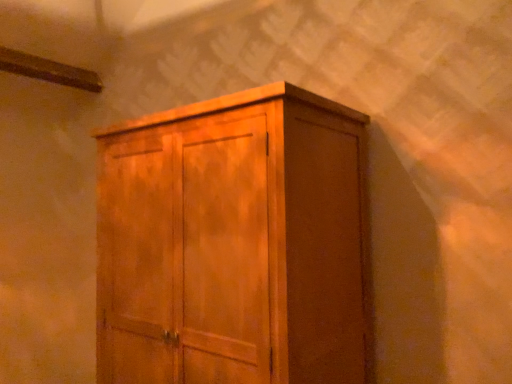
What do you see at coordinates (234, 243) in the screenshot? I see `matte wood cupboard at center` at bounding box center [234, 243].

This screenshot has width=512, height=384. Find the location of `matte wood cupboard at center`. matte wood cupboard at center is located at coordinates (234, 243).

In order to click on matte wood cupboard at center in this screenshot , I will do `click(234, 243)`.